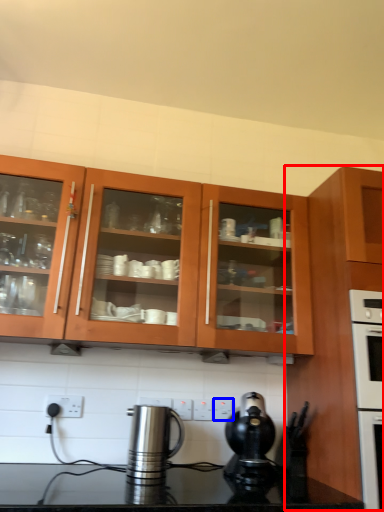
Question: Which of the following is the closest to the observer, cabinetry (highlighted by a red box) or electric outlet (highlighted by a blue box)?

Choices:
 (A) cabinetry
 (B) electric outlet

Answer: (A)